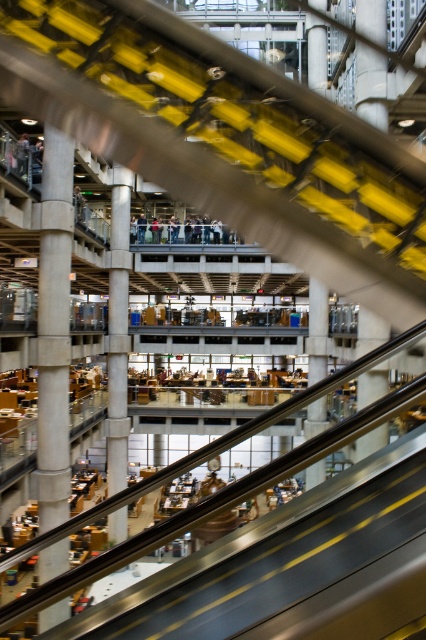
Is concrete pillar at center further to the viewer compared to smooth gray pillar at center?

No, concrete pillar at center is in front of smooth gray pillar at center.

Between concrete pillar at center and smooth gray pillar at center, which one is positioned lower?

smooth gray pillar at center

The width and height of the screenshot is (426, 640). What are the coordinates of `concrete pillar at center` in the screenshot? It's located at pyautogui.click(x=54, y=330).

The width and height of the screenshot is (426, 640). Find the location of `concrete pillar at center`. concrete pillar at center is located at coordinates (x=54, y=330).

Is point (183, 237) more distant than point (25, 132)?

Yes, point (183, 237) is behind point (25, 132).

Who is more forward, (131, 232) or (19, 170)?

Point (19, 170) is more forward.

Image resolution: width=426 pixels, height=640 pixels. Find the location of `dark blue jeans at center`. dark blue jeans at center is located at coordinates (181, 230).

Between concrete at center and matte black jacket at upper center, which one has less height?

matte black jacket at upper center

Does concrete at center have a greater height compared to matte black jacket at upper center?

Yes.

What do you see at coordinates (316, 332) in the screenshot?
I see `concrete at center` at bounding box center [316, 332].

The height and width of the screenshot is (640, 426). Find the location of `concrete at center`. concrete at center is located at coordinates (316, 332).